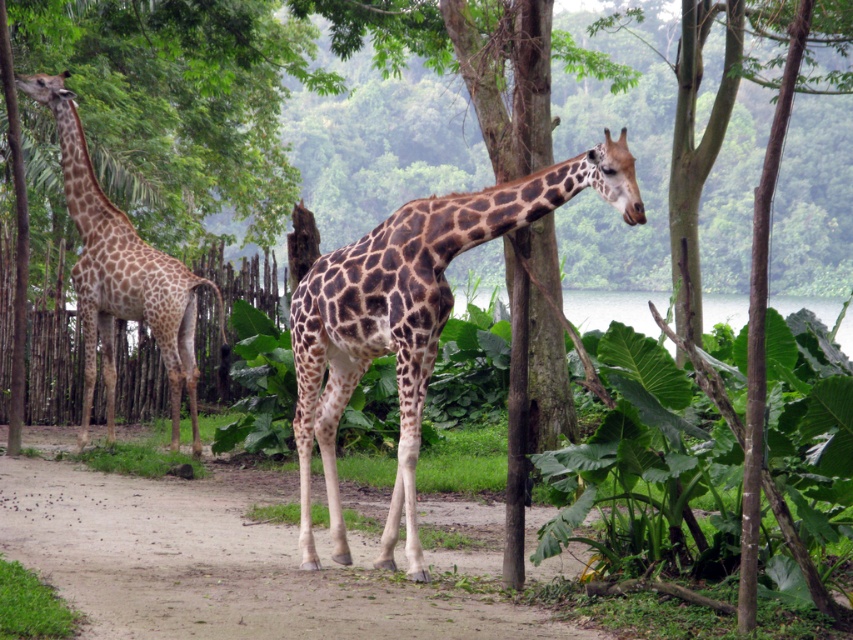
Can you confirm if spotted fur giraffe at center is positioned above spotted fur giraffe at left?

Incorrect, spotted fur giraffe at center is not positioned above spotted fur giraffe at left.

From the picture: Can you confirm if spotted fur giraffe at center is positioned to the left of spotted fur giraffe at left?

In fact, spotted fur giraffe at center is to the right of spotted fur giraffe at left.

Is point (317, 272) positioned in front of point (193, 368)?

Yes, it is in front of point (193, 368).

This screenshot has height=640, width=853. I want to click on spotted fur giraffe at center, so click(410, 317).

Can you confirm if green leafy plant at center is bigger than spotted fur giraffe at center?

Yes.

Is green leafy plant at center smaller than spotted fur giraffe at center?

No, green leafy plant at center is not smaller than spotted fur giraffe at center.

Find the location of a particular element. This screenshot has height=640, width=853. green leafy plant at center is located at coordinates (643, 467).

Is dusty sand path at lower center above spotted fur giraffe at center?

No.

Which is more to the right, dusty sand path at lower center or spotted fur giraffe at center?

spotted fur giraffe at center

Which is in front, point (27, 484) or point (418, 312)?

Point (418, 312) is more forward.

Locate an element on the screen. The height and width of the screenshot is (640, 853). dusty sand path at lower center is located at coordinates (239, 560).